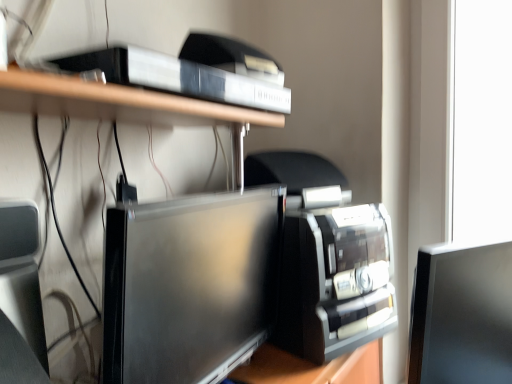
Question: Which direction should I rotate to look at satin black monitor at center, which is the 2th computer monitor in right-to-left order?

Choices:
 (A) left
 (B) right

Answer: (A)

Question: Is satin black monitor at right, the second computer monitor in the left-to-right sequence, a part of white plastic shelf at upper center?

Choices:
 (A) yes
 (B) no

Answer: (B)

Question: From a real-world perspective, is white plastic shelf at upper center positioned over satin black monitor at right, which appears as the 1th computer monitor when viewed from the right, based on gravity?

Choices:
 (A) yes
 (B) no

Answer: (A)

Question: Is the position of white plastic shelf at upper center more distant than that of satin black monitor at right, the second computer monitor in the left-to-right sequence?

Choices:
 (A) no
 (B) yes

Answer: (A)

Question: Considering the relative sizes of white plastic shelf at upper center and satin black monitor at right, which appears as the 1th computer monitor when viewed from the right, in the image provided, is white plastic shelf at upper center taller than satin black monitor at right, which appears as the 1th computer monitor when viewed from the right,?

Choices:
 (A) no
 (B) yes

Answer: (A)

Question: From a real-world perspective, is white plastic shelf at upper center physically below satin black monitor at right, the second computer monitor in the left-to-right sequence?

Choices:
 (A) yes
 (B) no

Answer: (B)

Question: From the image's perspective, does white plastic shelf at upper center appear lower than satin black monitor at right, which appears as the 1th computer monitor when viewed from the right?

Choices:
 (A) no
 (B) yes

Answer: (A)

Question: Is satin black monitor at right, the second computer monitor in the left-to-right sequence, far from satin black monitor at center, the 1th computer monitor in the left-to-right sequence?

Choices:
 (A) no
 (B) yes

Answer: (A)

Question: Is satin black monitor at right, the second computer monitor in the left-to-right sequence, positioned beyond the bounds of satin black monitor at center, the 1th computer monitor in the left-to-right sequence?

Choices:
 (A) yes
 (B) no

Answer: (A)

Question: Considering the relative positions of satin black monitor at right, which appears as the 1th computer monitor when viewed from the right, and satin black monitor at center, which is the 2th computer monitor in right-to-left order, in the image provided, is satin black monitor at right, which appears as the 1th computer monitor when viewed from the right, to the right of satin black monitor at center, which is the 2th computer monitor in right-to-left order, from the viewer's perspective?

Choices:
 (A) yes
 (B) no

Answer: (A)

Question: Considering the relative positions of satin black monitor at right, which appears as the 1th computer monitor when viewed from the right, and satin black monitor at center, which is the 2th computer monitor in right-to-left order, in the image provided, is satin black monitor at right, which appears as the 1th computer monitor when viewed from the right, to the left of satin black monitor at center, which is the 2th computer monitor in right-to-left order, from the viewer's perspective?

Choices:
 (A) yes
 (B) no

Answer: (B)

Question: Is satin black monitor at right, the second computer monitor in the left-to-right sequence, taller than satin black monitor at center, the 1th computer monitor in the left-to-right sequence?

Choices:
 (A) no
 (B) yes

Answer: (B)

Question: Is satin black monitor at center, which is the 2th computer monitor in right-to-left order, inside satin black monitor at right, which appears as the 1th computer monitor when viewed from the right?

Choices:
 (A) no
 (B) yes

Answer: (A)

Question: Does white plastic shelf at upper center have a greater height compared to satin black monitor at center, which is the 2th computer monitor in right-to-left order?

Choices:
 (A) no
 (B) yes

Answer: (A)